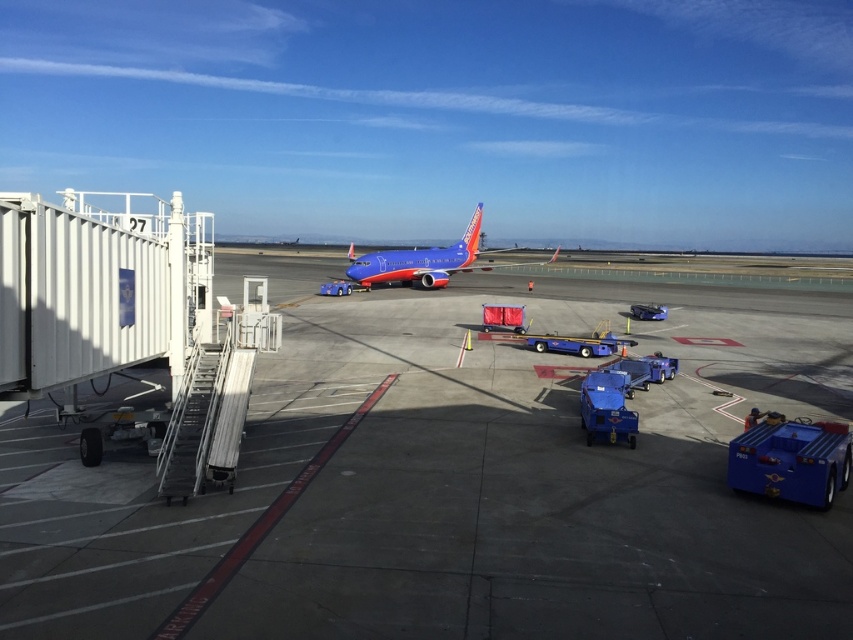
You are a pilot preparing to taxi your plane to the runway. You need to know if there is enough space between the smooth concrete tarmac at center and the blue painted airplane at center for your aircraft to maneuver safely. Can you confirm if the space is sufficient?

The smooth concrete tarmac at center is wider than the blue painted airplane at center, so there should be sufficient space for your aircraft to maneuver safely between them.

You are standing at the jet bridge labeled 27 and want to walk to a specific point on the tarmac. The point you need to reach is labeled as point (250,524). Given that you can only walk on the tarmac areas marked with red and white lines, can you safely reach that point without stepping off the designated paths?

The distance of point (250,524) from viewer is 6.14 meters. Since the path to this point is marked with red and white lines, you can safely reach it by following the designated paths on the tarmac.

What is the exact coordinate of the smooth concrete tarmac at center?

The smooth concrete tarmac at center is located at point (453, 483).